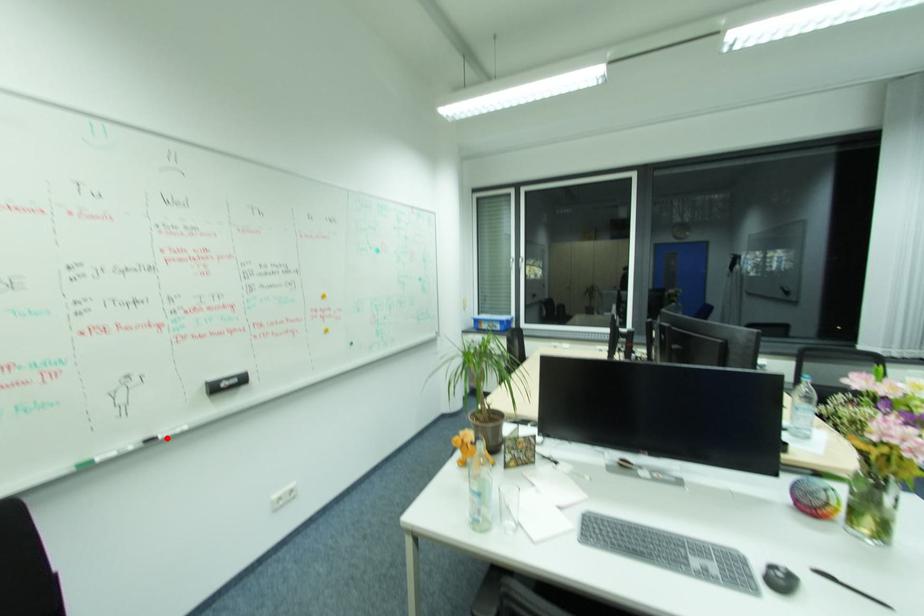
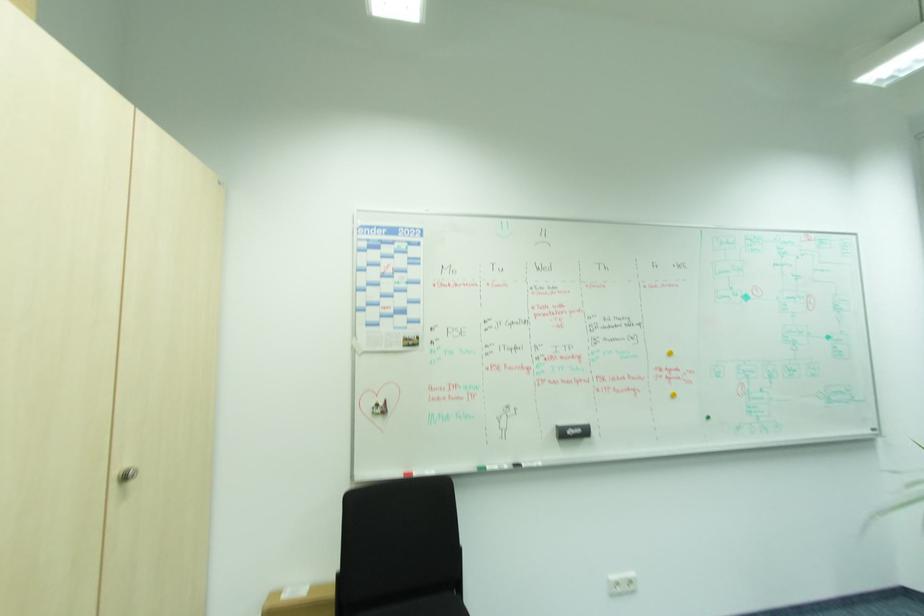
Question: I am providing you with two images of the same scene from different viewpoints. A red point is shown in image1. For the corresponding object point in image2, is it positioned nearer or farther from the camera?

Choices:
 (A) Nearer
 (B) Farther

Answer: (B)